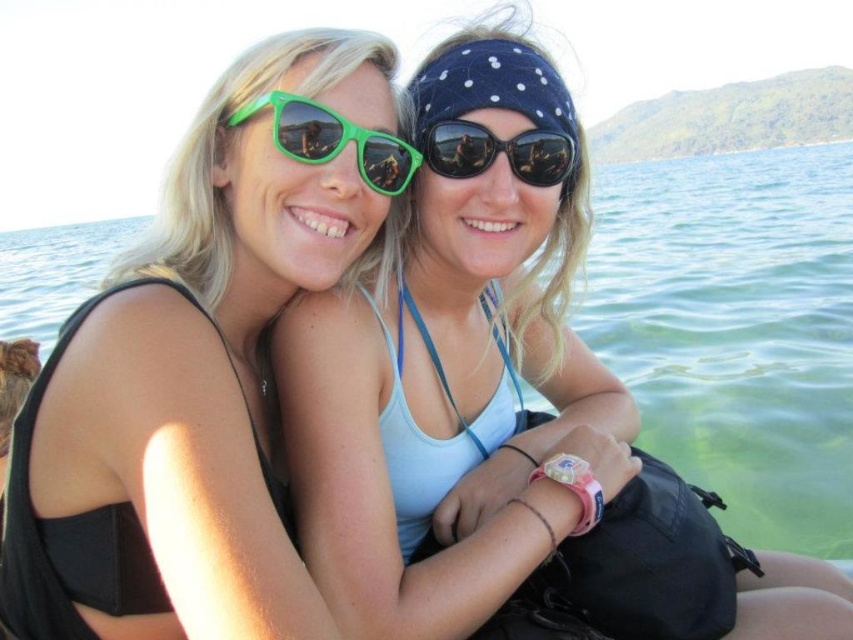
You are a photographer standing at the edge of the water. You want to take a photo of the matte green sunglasses at center and the green translucent water at center. If your camera can focus on objects up to 60 meters away, will both objects be in focus?

The distance between the matte green sunglasses at center and the green translucent water at center is 58.07 meters. Since the camera can focus up to 60 meters, both objects will be in focus as the distance is within the camera range.

You are a photographer trying to capture a closeup of the matte green sunglasses at upper left and the clear blue water at left. Which object should you focus on first if you want to ensure both are in focus?

The matte green sunglasses at upper left is located below clear blue water at left, so focusing on the clear blue water at left first would help ensure both are in focus as they are at different distances.

You are a photographer trying to capture a closeup of both the matte green sunglasses at center and the green translucent water at center in the image. Given their sizes, which object would you need to zoom in more on to ensure both are clearly visible in the frame?

The matte green sunglasses at center occupies less space than the green translucent water at center, so you would need to zoom in more on the matte green sunglasses at center to ensure both are clearly visible in the frame.